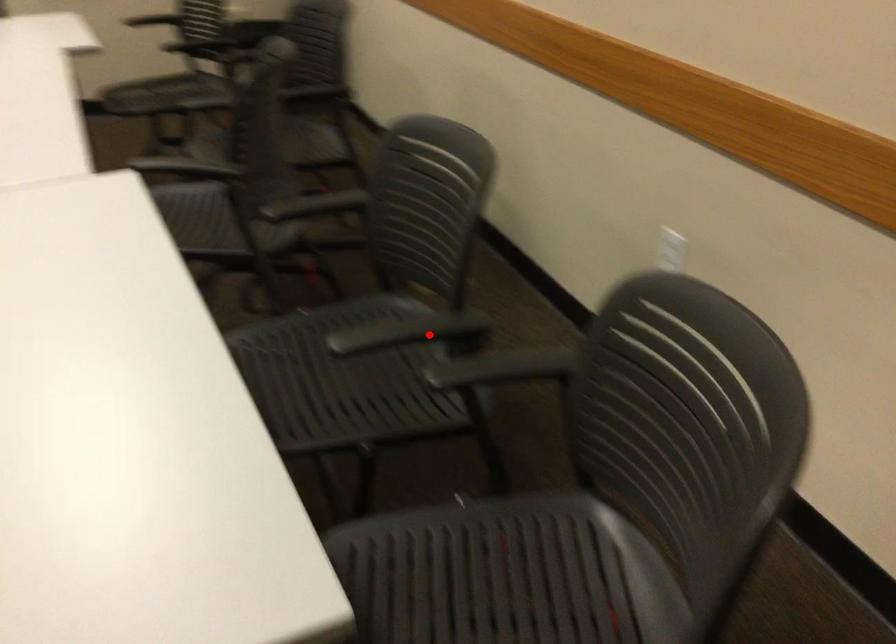
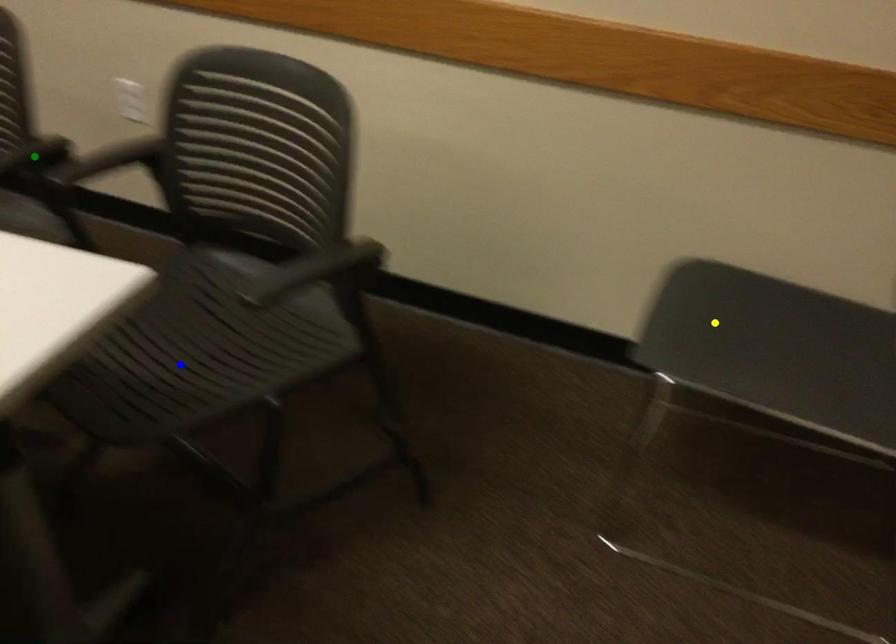
Question: I am providing you with two images of the same scene from different viewpoints. A red point is marked on the first image. You are given multiple points on the second image. Can you choose the point in image 2 that corresponds to the point in image 1?

Choices:
 (A) blue point
 (B) green point
 (C) yellow point

Answer: (B)